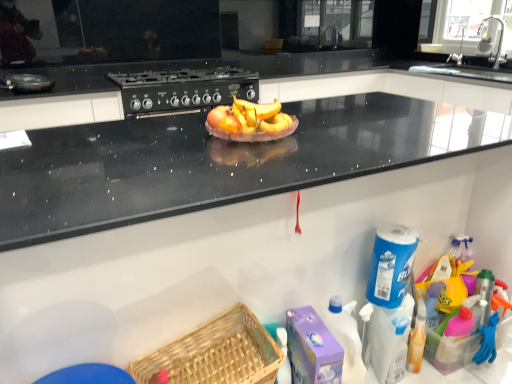
Question: Does yellow matte bananas at center have a greater width compared to black matte gas stove at upper center?

Choices:
 (A) no
 (B) yes

Answer: (A)

Question: Is yellow matte bananas at center bigger than black matte gas stove at upper center?

Choices:
 (A) yes
 (B) no

Answer: (B)

Question: From a real-world perspective, is yellow matte bananas at center over black matte gas stove at upper center?

Choices:
 (A) yes
 (B) no

Answer: (A)

Question: Is yellow matte bananas at center taller than black matte gas stove at upper center?

Choices:
 (A) yes
 (B) no

Answer: (B)

Question: From a real-world perspective, is yellow matte bananas at center beneath black matte gas stove at upper center?

Choices:
 (A) yes
 (B) no

Answer: (B)

Question: Considering the positions of yellow matte bananas at center and black matte gas stove at upper center in the image, is yellow matte bananas at center bigger or smaller than black matte gas stove at upper center?

Choices:
 (A) small
 (B) big

Answer: (A)

Question: Considering their positions, is yellow matte bananas at center located in front of or behind black matte gas stove at upper center?

Choices:
 (A) front
 (B) behind

Answer: (A)

Question: Choose the correct answer: Is yellow matte bananas at center inside black matte gas stove at upper center or outside it?

Choices:
 (A) inside
 (B) outside

Answer: (B)

Question: Is yellow matte bananas at center wider or thinner than black matte gas stove at upper center?

Choices:
 (A) thin
 (B) wide

Answer: (A)

Question: From the image's perspective, is metallic faucet at upper right, placed as the 2th faucet when sorted from back to front, above or below black matte pan at upper left?

Choices:
 (A) below
 (B) above

Answer: (B)

Question: Based on their sizes in the image, would you say metallic faucet at upper right, placed as the 2th faucet when sorted from back to front, is bigger or smaller than black matte pan at upper left?

Choices:
 (A) small
 (B) big

Answer: (B)

Question: Is metallic faucet at upper right, arranged as the first faucet when viewed from the front, to the left or to the right of black matte pan at upper left in the image?

Choices:
 (A) left
 (B) right

Answer: (B)

Question: Is metallic faucet at upper right, placed as the 2th faucet when sorted from back to front, in front of or behind black matte pan at upper left in the image?

Choices:
 (A) behind
 (B) front

Answer: (A)

Question: Considering the relative positions of black matte gas stove at upper center and metallic faucet at upper right, arranged as the first faucet when viewed from the front, in the image provided, is black matte gas stove at upper center to the left or to the right of metallic faucet at upper right, arranged as the first faucet when viewed from the front,?

Choices:
 (A) left
 (B) right

Answer: (A)

Question: From the image's perspective, is black matte gas stove at upper center positioned above or below metallic faucet at upper right, placed as the 2th faucet when sorted from back to front?

Choices:
 (A) below
 (B) above

Answer: (A)